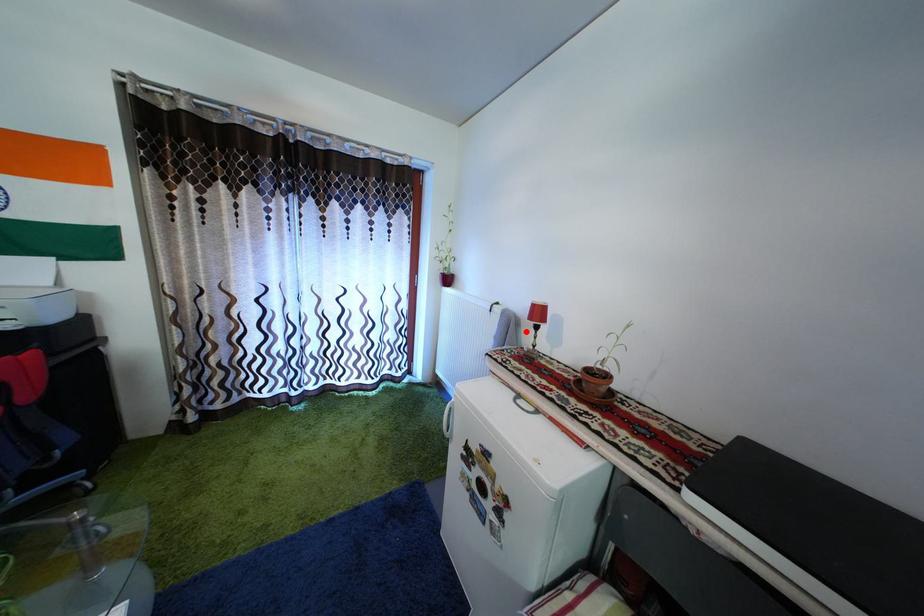
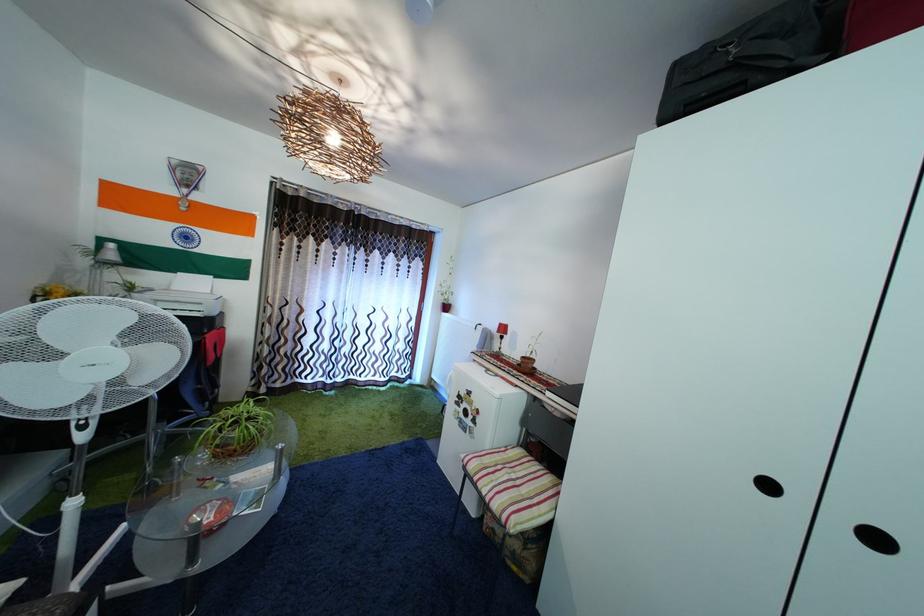
Find the pixel in the second image that matches the highlighted location in the first image.

(500, 345)